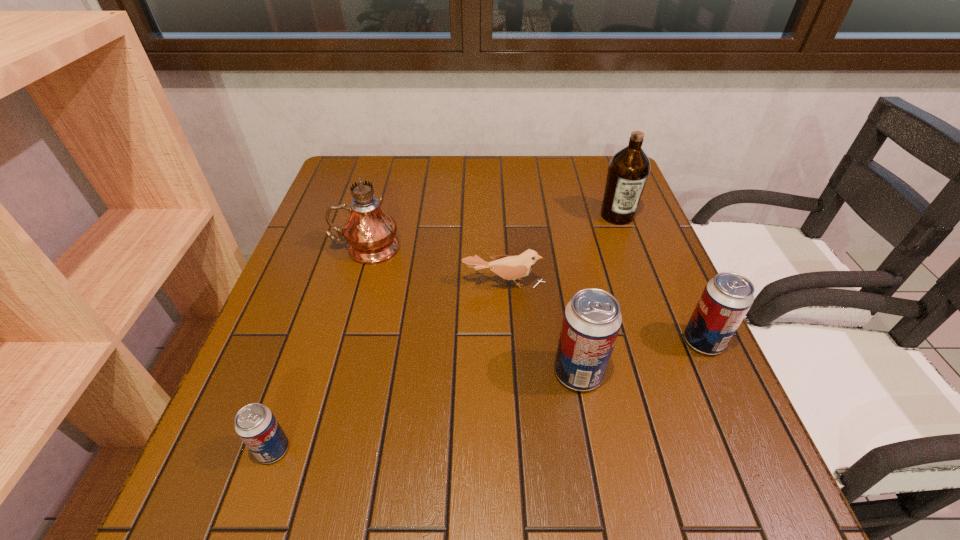
Identify the location of free spot between the leftmost beer can and the fifth nearest object. The height and width of the screenshot is (540, 960). (320, 348).

Locate an element on the screen. The image size is (960, 540). vacant area that lies between the nearest beer can and the fourth nearest object is located at coordinates (389, 366).

Locate an element on the screen. This screenshot has width=960, height=540. empty location between the nearest beer can and the tallest object is located at coordinates (320, 348).

Locate an element on the screen. The image size is (960, 540). unoccupied position between the second tallest object and the nearest beer can is located at coordinates point(445,333).

At what (x,y) coordinates should I click in order to perform the action: click on empty space between the nearest object and the tallest object. Please return your answer as a coordinate pair (x, y). Looking at the image, I should click on (320, 348).

Locate an element on the screen. This screenshot has height=540, width=960. empty location between the bird and the fifth shortest object is located at coordinates (561, 249).

This screenshot has width=960, height=540. Find the location of `free space between the third farthest object and the second beer can from left to right`. free space between the third farthest object and the second beer can from left to right is located at coordinates (541, 328).

You are a GUI agent. You are given a task and a screenshot of the screen. Output one action in this format:
    pyautogui.click(x=<x>, y=<y>)
    Task: Click on the free spot between the second tallest object and the nearest beer can
    This screenshot has width=960, height=540.
    Given the screenshot: What is the action you would take?
    [x=445, y=333]

Locate an element on the screen. Image resolution: width=960 pixels, height=540 pixels. unoccupied position between the leftmost beer can and the oil lamp is located at coordinates (320, 348).

Select which object is the second closest to the bird. Please provide its 2D coordinates. Your answer should be formatted as a tuple, i.e. [(x, y)], where the tuple contains the x and y coordinates of a point satisfying the conditions above.

[(592, 319)]